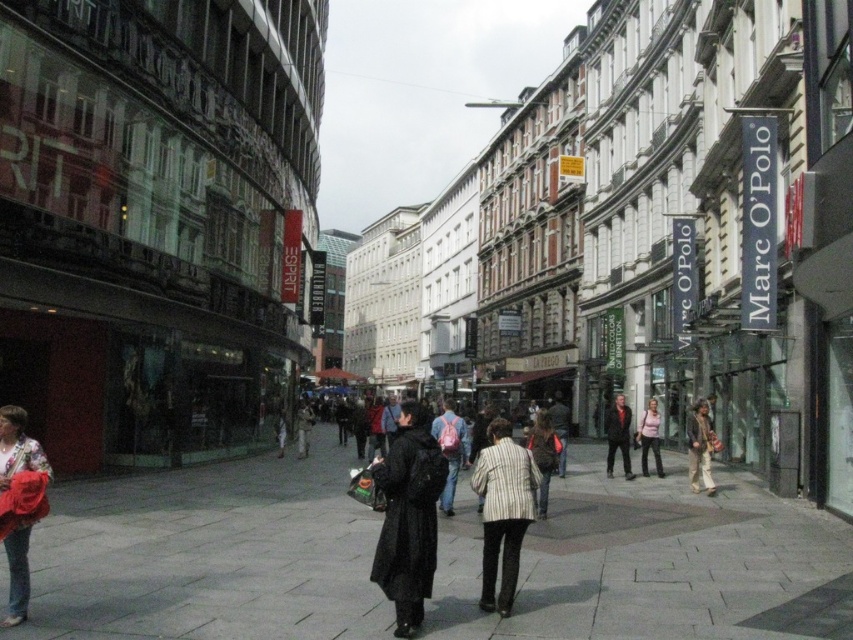
In the scene shown: You are standing on the sidewalk and want to cross the street to reach the building with the red banner on the left. If your walking speed is 1.5 meters per second, how many seconds will it take to reach the gray stone pavement at center from your current position?

The gray stone pavement at center is 22.55 meters away from the viewer. At a walking speed of 1.5 meters per second, it will take approximately 15.03 seconds to reach the gray stone pavement at center.

From the picture: You are a delivery person who needs to place both the matte pink backpack at center and the dark brown leather jacket at center into a storage locker. The locker has a width restriction of 15 cm. Which item should you place first to ensure both fit?

The matte pink backpack at center is thinner than the dark brown leather jacket at center, so you should place the dark brown leather jacket at center first to accommodate its greater thickness before adding the thinner backpack.